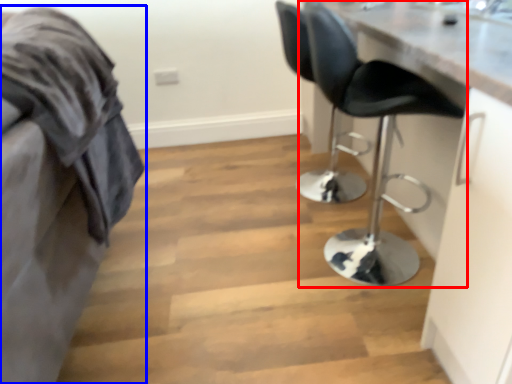
Question: Which of the following is the farthest to the observer, chair (highlighted by a red box) or furniture (highlighted by a blue box)?

Choices:
 (A) chair
 (B) furniture

Answer: (A)